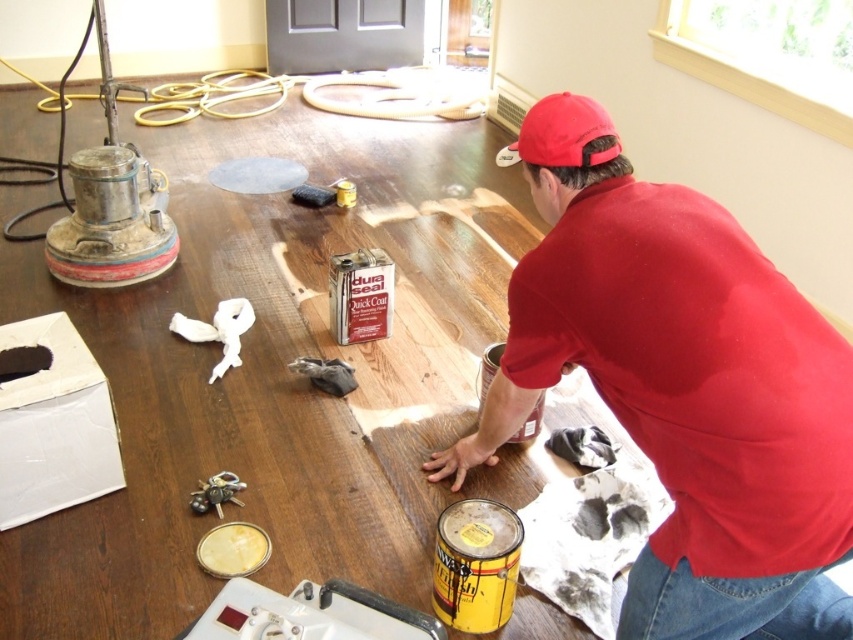
Question: Which point appears closest to the camera in this image?

Choices:
 (A) (567, 99)
 (B) (741, 435)

Answer: (B)

Question: Is matte red shirt at center further to camera compared to red fabric baseball cap at upper center?

Choices:
 (A) yes
 (B) no

Answer: (B)

Question: Which point is closer to the camera?

Choices:
 (A) matte red shirt at center
 (B) red fabric baseball cap at upper center

Answer: (A)

Question: Is matte red shirt at center to the right of red fabric baseball cap at upper center from the viewer's perspective?

Choices:
 (A) no
 (B) yes

Answer: (B)

Question: Is matte red shirt at center to the right of red fabric baseball cap at upper center from the viewer's perspective?

Choices:
 (A) yes
 (B) no

Answer: (A)